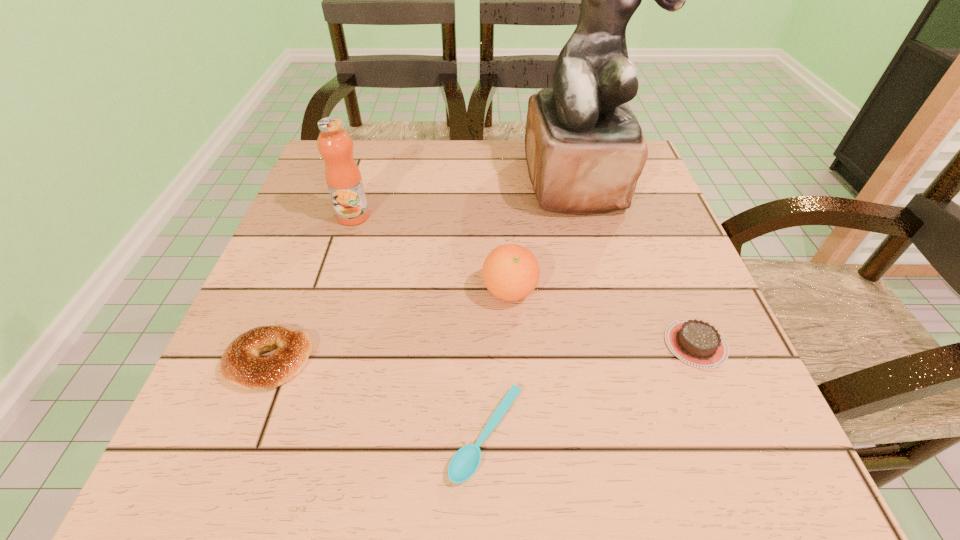
The height and width of the screenshot is (540, 960). In order to click on unoccupied position between the spoon and the second shortest object in this screenshot , I will do `click(591, 389)`.

Find the location of a particular element. Image resolution: width=960 pixels, height=540 pixels. vacant space that is in between the shortest object and the orange is located at coordinates (498, 363).

The width and height of the screenshot is (960, 540). What are the coordinates of `free space between the chocolate cake and the bagel` in the screenshot? It's located at (483, 353).

This screenshot has height=540, width=960. I want to click on vacant space that's between the chocolate cake and the bagel, so click(483, 353).

Where is `free spot between the spoon and the fourth nearest object`? The width and height of the screenshot is (960, 540). free spot between the spoon and the fourth nearest object is located at coordinates (498, 363).

The height and width of the screenshot is (540, 960). What are the coordinates of `free space between the sculpture and the bagel` in the screenshot? It's located at (423, 272).

Identify the location of empty location between the spoon and the second shortest object. This screenshot has height=540, width=960. (591, 389).

Where is `object that is the closest one to the bagel`? object that is the closest one to the bagel is located at coordinates (463, 465).

Image resolution: width=960 pixels, height=540 pixels. In order to click on the fifth closest object to the chocolate cake in this screenshot , I will do pyautogui.click(x=343, y=177).

Where is `blank space that satisfies the following two spatial constraints: 1. on the front side of the fruit juice; 2. on the right side of the spoon`? blank space that satisfies the following two spatial constraints: 1. on the front side of the fruit juice; 2. on the right side of the spoon is located at coordinates (284, 434).